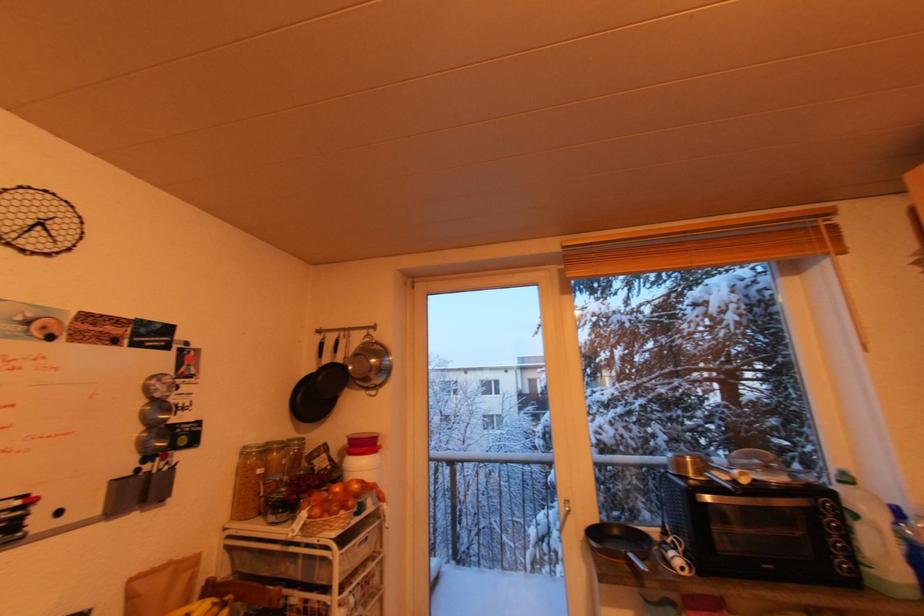
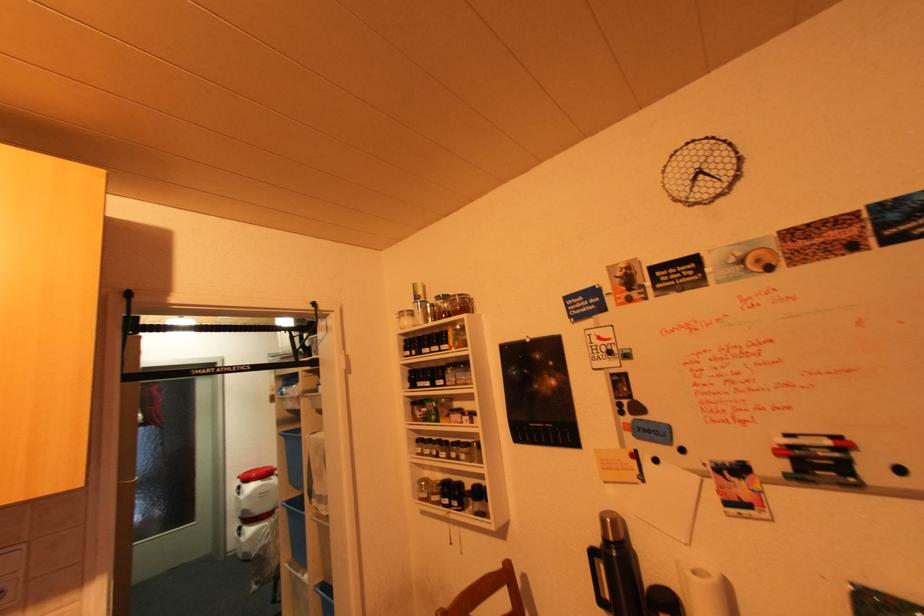
Question: The camera is either moving clockwise (left) or counter-clockwise (right) around the object. The first image is from the beginning of the video and the second image is from the end. Is the camera moving left or right when shooting the video?

Choices:
 (A) Left
 (B) Right

Answer: (B)